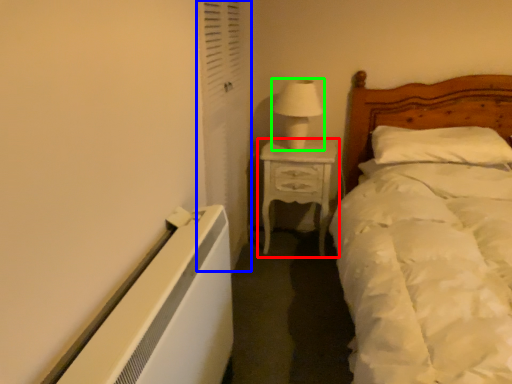
Question: Estimate the real-world distances between objects in this image. Which object is closer to nightstand (highlighted by a red box), screen door (highlighted by a blue box) or table lamp (highlighted by a green box)?

Choices:
 (A) screen door
 (B) table lamp

Answer: (B)